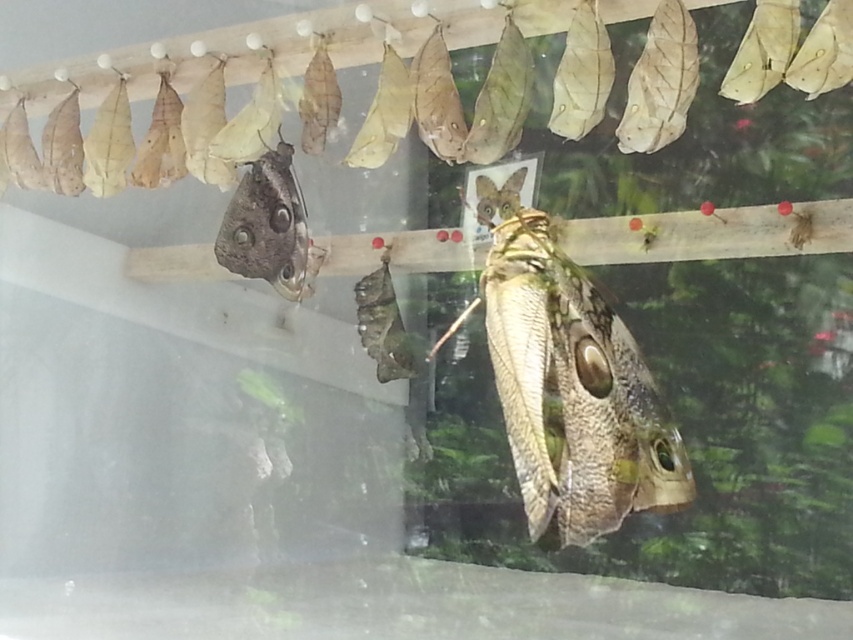
Looking at this image, you are a researcher observing the butterfly metamorphosis setup. You notice two points marked in the image. Which point is nearer to you, point 1 at coordinates point (659, 460) or point 2 at coordinates point (273, 259)?

Point 1 at coordinates point (659, 460) is closer to the viewer than point 2 at coordinates point (273, 259).